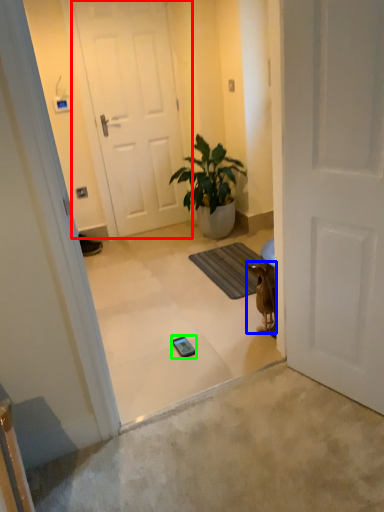
Question: Which object is positioned closest to door (highlighted by a red box)? Select from animal (highlighted by a blue box) and mobile phone (highlighted by a green box).

Choices:
 (A) animal
 (B) mobile phone

Answer: (A)